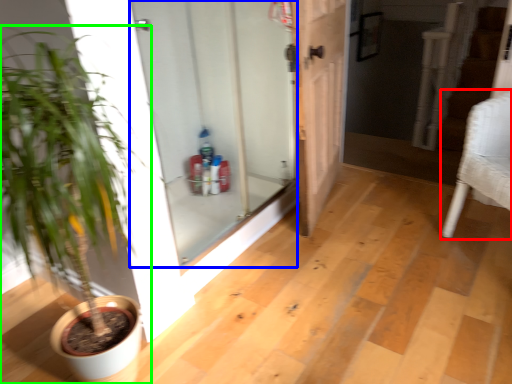
Question: Estimate the real-world distances between objects in this image. Which object is farther from armchair (highlighted by a red box), door (highlighted by a blue box) or houseplant (highlighted by a green box)?

Choices:
 (A) door
 (B) houseplant

Answer: (B)